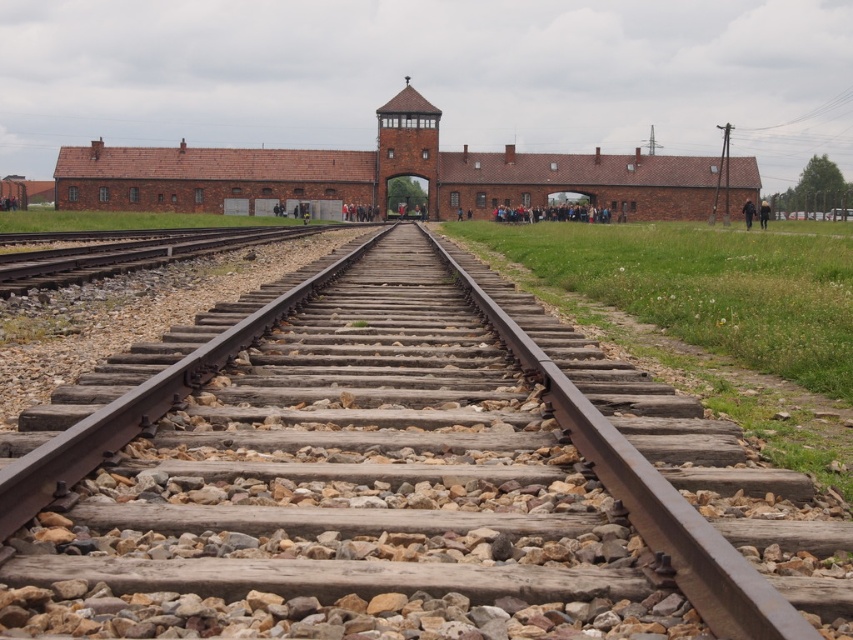
Question: Can you confirm if brown brick building at center is wider than black fabric jacket at center?

Choices:
 (A) yes
 (B) no

Answer: (A)

Question: Can you confirm if brown brick building at center is wider than black fabric jacket at center?

Choices:
 (A) yes
 (B) no

Answer: (A)

Question: Does brown brick building at center come behind black leather jacket at center?

Choices:
 (A) no
 (B) yes

Answer: (B)

Question: Which is nearer to the brown wooden track at center?

Choices:
 (A) brown brick building at center
 (B) black fabric jacket at center
 (C) black leather jacket at center

Answer: (B)

Question: Which is nearer to the brown brick building at center?

Choices:
 (A) brown wooden track at center
 (B) black leather jacket at center

Answer: (B)

Question: Which point is closer to the camera?

Choices:
 (A) black leather jacket at center
 (B) brown brick building at center

Answer: (A)